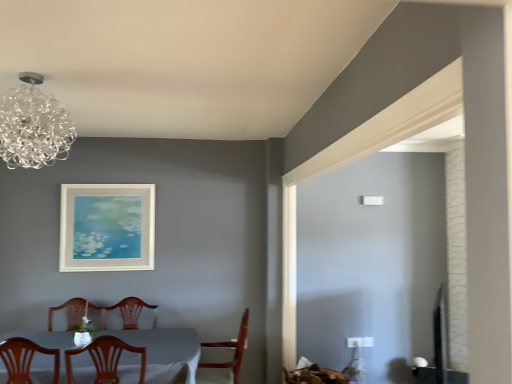
This screenshot has width=512, height=384. Find the location of `blank space situated above transparent glass chandelier at upper left (from a real-world perspective)`. blank space situated above transparent glass chandelier at upper left (from a real-world perspective) is located at coordinates (49, 70).